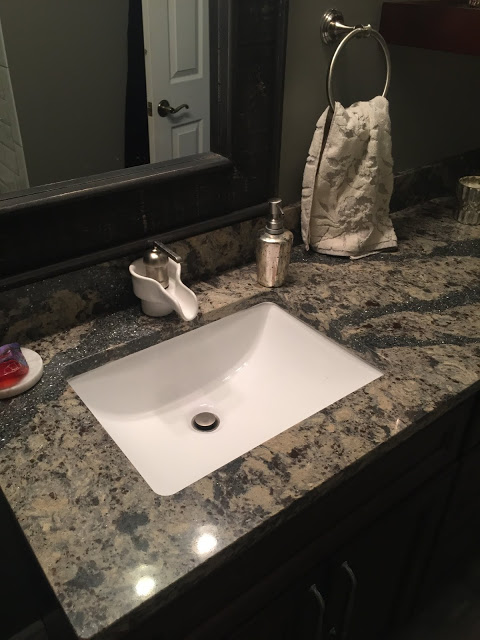
At what (x,y) coordinates should I click in order to perform the action: click on towel. Please return your answer as a coordinate pair (x, y). Looking at the image, I should click on (361, 189).